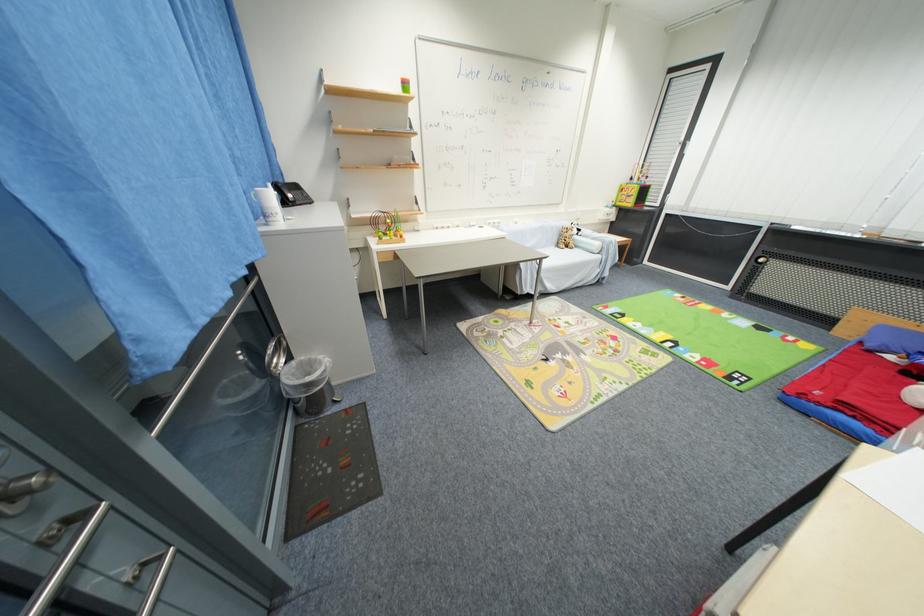
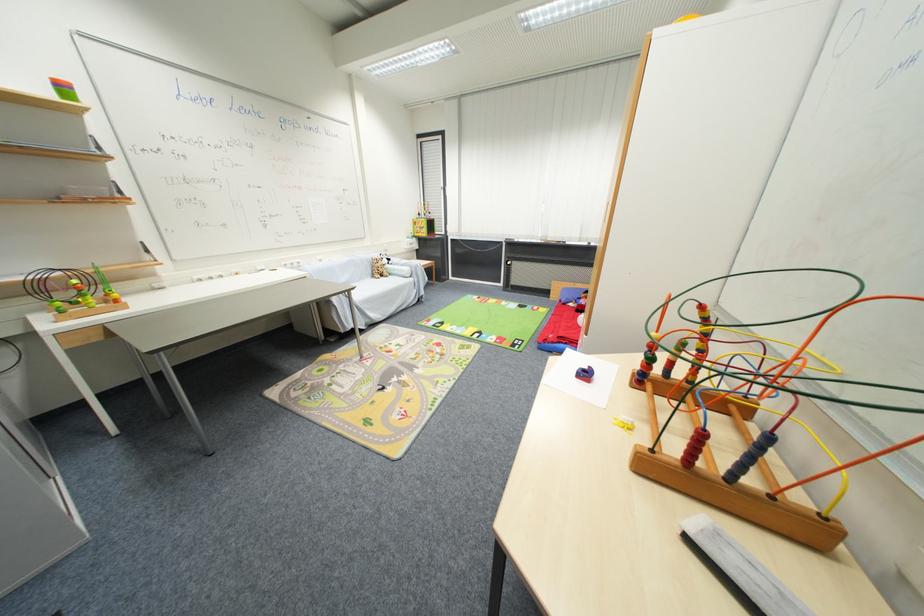
Question: The images are taken continuously from a first-person perspective. In which direction is your viewpoint rotating?

Choices:
 (A) Left
 (B) Right
 (C) Up
 (D) Down

Answer: (B)